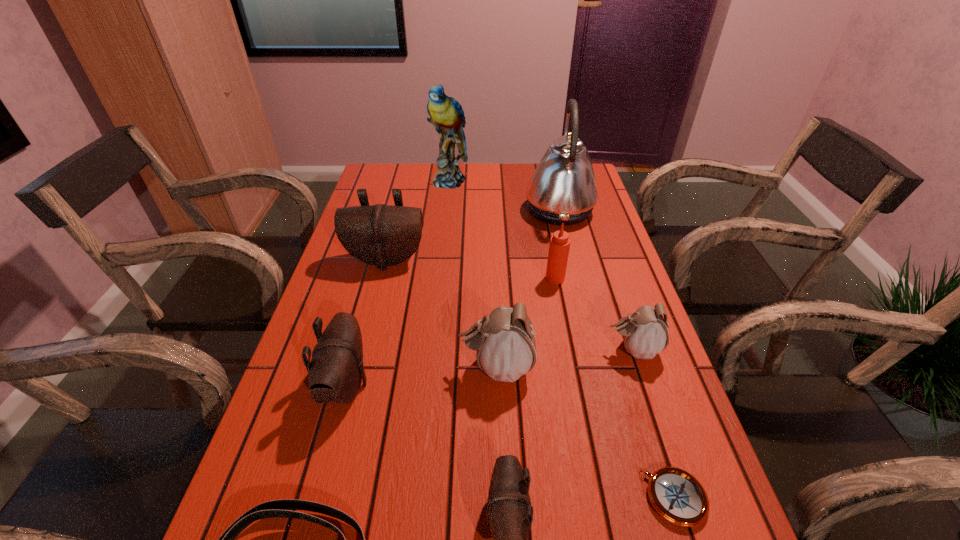
In the image, there is a desktop. Where is `vacant space at the right edge`? The height and width of the screenshot is (540, 960). vacant space at the right edge is located at coordinates (645, 397).

Where is `free space between the farthest pouch and the smaller white pouch`? Image resolution: width=960 pixels, height=540 pixels. free space between the farthest pouch and the smaller white pouch is located at coordinates (510, 305).

Where is `unoccupied position between the kettle and the right white pouch`? unoccupied position between the kettle and the right white pouch is located at coordinates (596, 280).

Where is `unoccupied position between the farthest brown pouch and the Tabasco sauce`? The height and width of the screenshot is (540, 960). unoccupied position between the farthest brown pouch and the Tabasco sauce is located at coordinates (470, 269).

Identify the location of free space between the compass and the second smallest brown pouch. The image size is (960, 540). (511, 442).

The image size is (960, 540). In order to click on empty location between the compass and the right white pouch in this screenshot , I will do `click(654, 424)`.

Locate an element on the screen. This screenshot has width=960, height=540. vacant space that's between the bigger white pouch and the parrot is located at coordinates (472, 274).

This screenshot has width=960, height=540. Find the location of `free space between the farthest brown pouch and the Tabasco sauce`. free space between the farthest brown pouch and the Tabasco sauce is located at coordinates (470, 269).

I want to click on the sixth closest object to the kettle, so click(336, 371).

Locate an element on the screen. object that is the third closest one to the parrot is located at coordinates (559, 246).